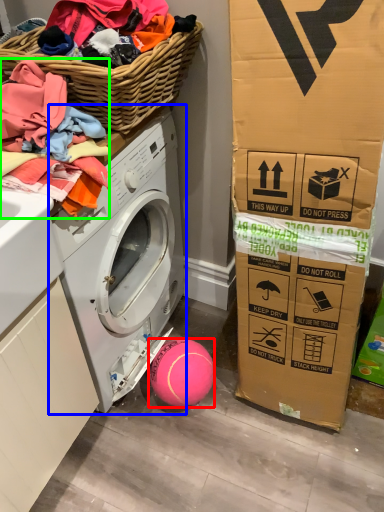
Question: Which is farther away from ball (highlighted by a red box)? washing machine (highlighted by a blue box) or clothing (highlighted by a green box)?

Choices:
 (A) washing machine
 (B) clothing

Answer: (B)